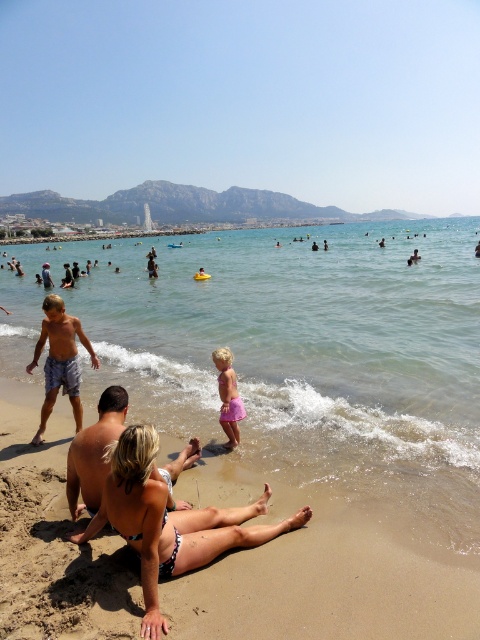
Who is shorter, brown sandy beach at lower center or white bikini bottom at lower center?

Standing shorter between the two is brown sandy beach at lower center.

Looking at this image, does brown sandy beach at lower center have a greater width compared to white bikini bottom at lower center?

Indeed, brown sandy beach at lower center has a greater width compared to white bikini bottom at lower center.

The height and width of the screenshot is (640, 480). What are the coordinates of `brown sandy beach at lower center` in the screenshot? It's located at (325, 586).

In order to click on brown sandy beach at lower center in this screenshot , I will do `click(325, 586)`.

Is white bikini bottom at lower center above matte blue shorts at left?

No.

Which is more to the left, white bikini bottom at lower center or matte blue shorts at left?

Positioned to the left is matte blue shorts at left.

This screenshot has height=640, width=480. Describe the element at coordinates (170, 522) in the screenshot. I see `white bikini bottom at lower center` at that location.

The width and height of the screenshot is (480, 640). Find the location of `white bikini bottom at lower center`. white bikini bottom at lower center is located at coordinates (170, 522).

Can you confirm if clear blue water at center is positioned to the left of white bikini bottom at lower center?

No, clear blue water at center is not to the left of white bikini bottom at lower center.

At what (x,y) coordinates should I click in order to perform the action: click on clear blue water at center. Please return your answer as a coordinate pair (x, y). Looking at the image, I should click on (295, 353).

Who is more forward, (321, 460) or (263, 529)?

Point (263, 529) is more forward.

Where is `clear blue water at center`? The width and height of the screenshot is (480, 640). clear blue water at center is located at coordinates [295, 353].